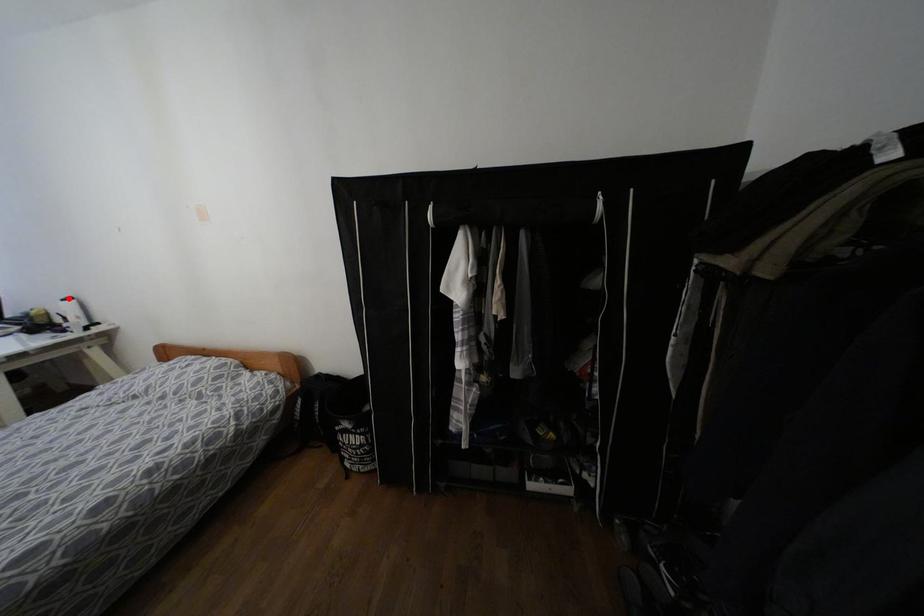
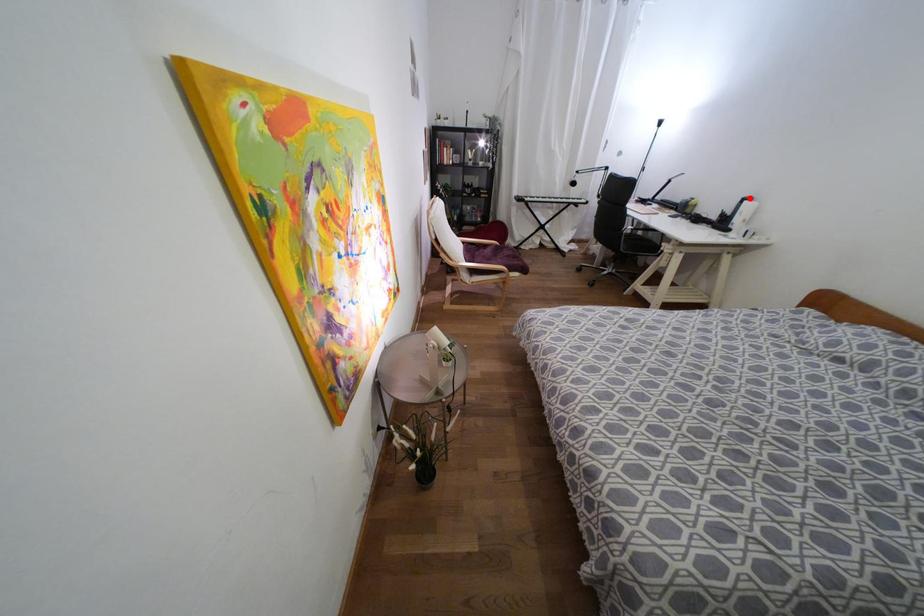
I am providing you with two images of the same scene from different viewpoints. A red point is marked on the first image and another point is marked on the second image. Are the points marked in image1 and image2 representing the same 3D position?

Yes